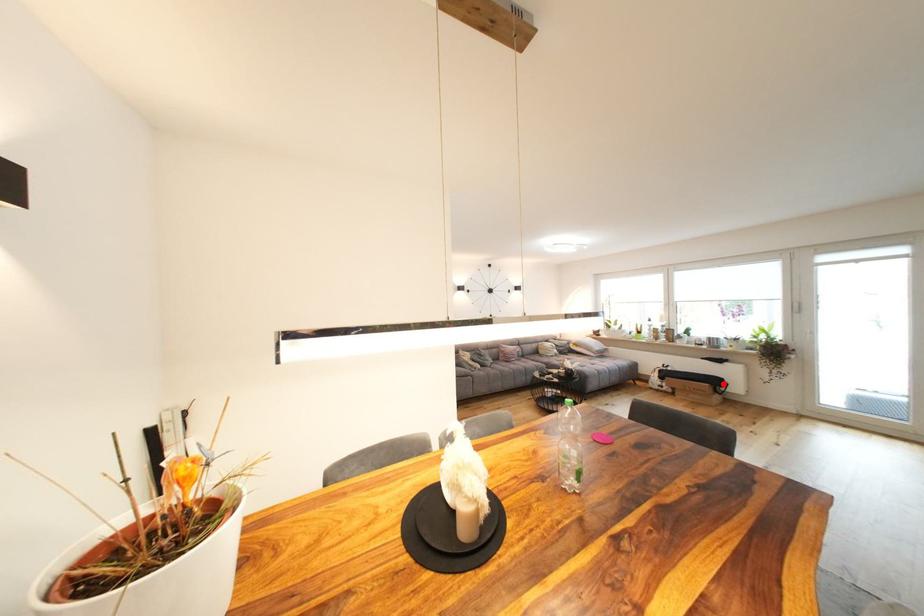
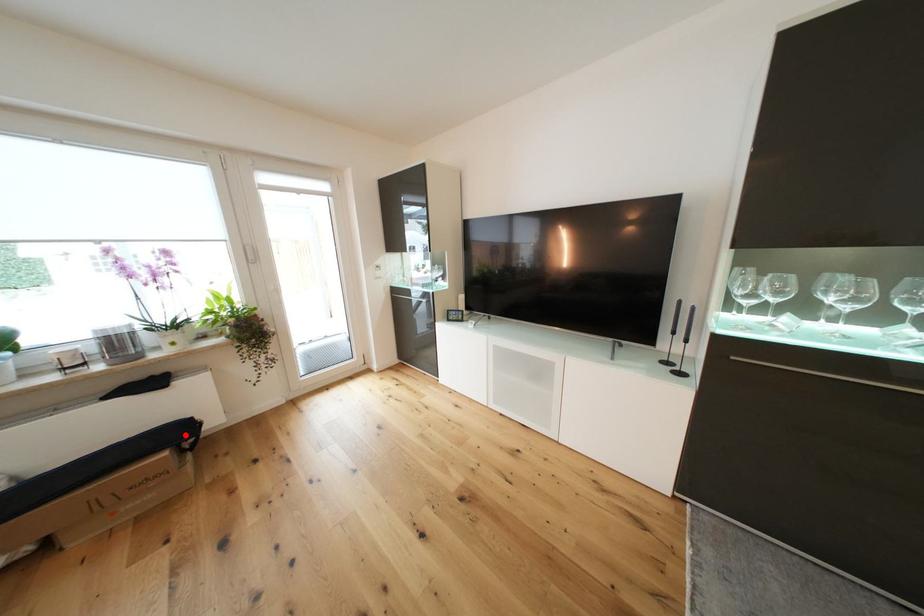
I am providing you with two images of the same scene from different viewpoints. A red point is marked on the first image and another point is marked on the second image. Are the points marked in image1 and image2 representing the same 3D position?

Yes